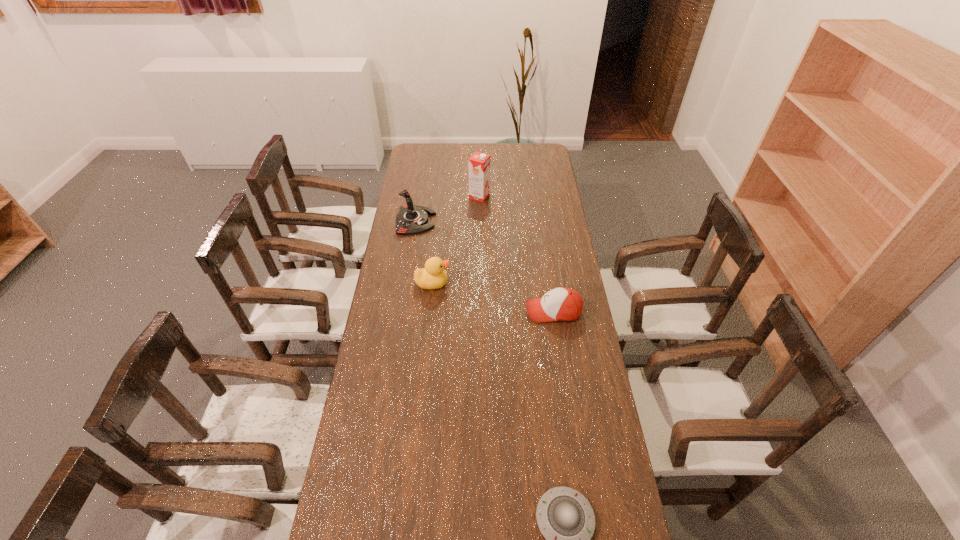
This screenshot has width=960, height=540. In order to click on carton in this screenshot , I will do `click(479, 163)`.

Locate an element on the screen. This screenshot has height=540, width=960. the third object from left to right is located at coordinates (479, 163).

The width and height of the screenshot is (960, 540). I want to click on the fourth nearest object, so click(x=412, y=219).

In order to click on joystick in this screenshot , I will do `click(412, 219)`.

Identify the location of the third shortest object. The image size is (960, 540). (433, 276).

Where is `duck`? Image resolution: width=960 pixels, height=540 pixels. duck is located at coordinates (433, 276).

At what (x,y) coordinates should I click in order to perform the action: click on the second shortest object. Please return your answer as a coordinate pair (x, y). Looking at the image, I should click on (563, 304).

This screenshot has width=960, height=540. In order to click on baseball cap in this screenshot , I will do `click(563, 304)`.

You are a GUI agent. You are given a task and a screenshot of the screen. Output one action in this format:
    pyautogui.click(x=<x>, y=<y>)
    Task: Click on the free space located 0.100m on the right of the carton
    
    Given the screenshot: What is the action you would take?
    pyautogui.click(x=510, y=196)

At what (x,y) coordinates should I click in order to perform the action: click on vacant region located on the handle side of the joystick. Please return your answer as a coordinate pair (x, y). This screenshot has height=540, width=960. Looking at the image, I should click on 488,221.